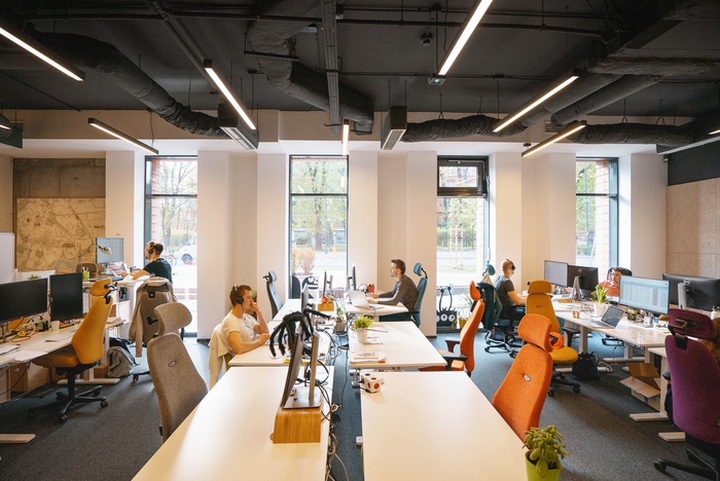
Identify the location of chair. The height and width of the screenshot is (481, 720). (98, 329), (145, 311), (180, 377), (274, 298), (420, 294), (469, 335), (523, 378), (539, 306), (495, 306), (688, 366).